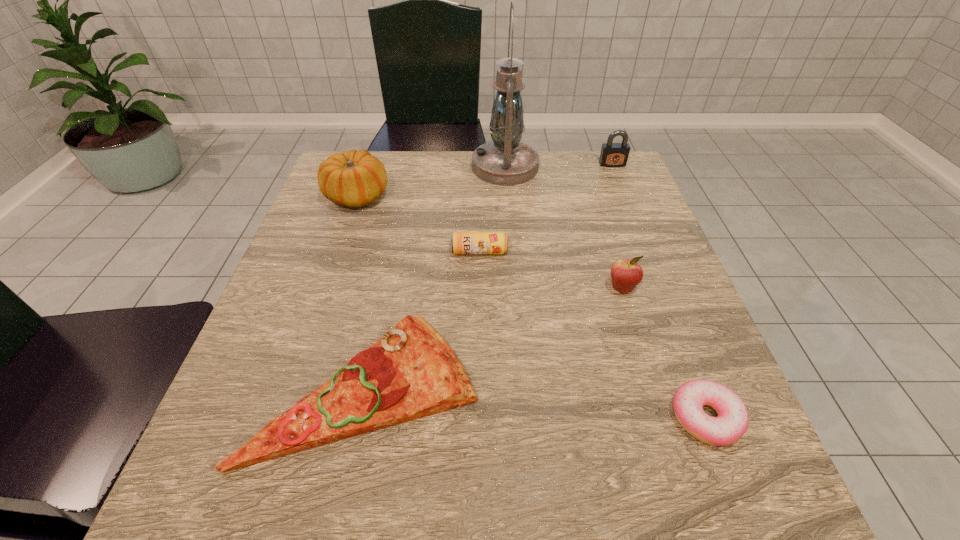
Image resolution: width=960 pixels, height=540 pixels. In order to click on oil lamp in this screenshot , I will do `click(505, 161)`.

At what (x,y) coordinates should I click in order to perform the action: click on gourd. Please return your answer as a coordinate pair (x, y). Looking at the image, I should click on (354, 178).

Locate an element on the screen. This screenshot has width=960, height=540. padlock is located at coordinates (612, 154).

At what (x,y) coordinates should I click in order to perform the action: click on apple. Please return your answer as a coordinate pair (x, y). The image size is (960, 540). Looking at the image, I should click on (626, 274).

This screenshot has height=540, width=960. Identify the location of beer can. (461, 242).

I want to click on pizza, so click(x=411, y=372).

I want to click on doughnut, so click(x=729, y=426).

Where is `free space located 0.350m on the left of the tallest object`? This screenshot has width=960, height=540. free space located 0.350m on the left of the tallest object is located at coordinates [x=344, y=167].

At what (x,y) coordinates should I click in order to perform the action: click on vacant space located on the front of the gourd. Please return your answer as a coordinate pair (x, y). Image resolution: width=960 pixels, height=540 pixels. Looking at the image, I should click on (339, 249).

You are a GUI agent. You are given a task and a screenshot of the screen. Output one action in this format:
    pyautogui.click(x=<x>, y=<y>)
    Task: Click on the free region located on the front of the padlock near the keyhole
    The height and width of the screenshot is (540, 960).
    Given the screenshot: What is the action you would take?
    pyautogui.click(x=624, y=193)